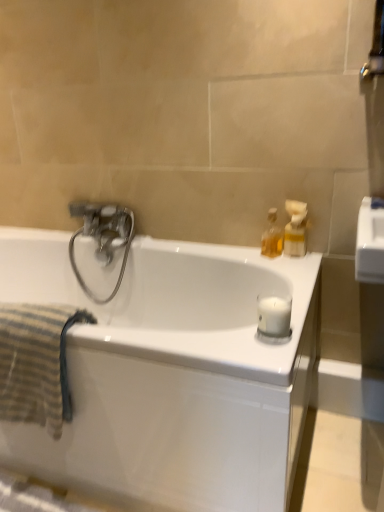
Question: Is white matte candle at right with metallic silver towel bar at upper right?

Choices:
 (A) yes
 (B) no

Answer: (B)

Question: Is white matte candle at right turned away from metallic silver towel bar at upper right?

Choices:
 (A) no
 (B) yes

Answer: (A)

Question: Considering the relative sizes of white matte candle at right and metallic silver towel bar at upper right in the image provided, is white matte candle at right smaller than metallic silver towel bar at upper right?

Choices:
 (A) no
 (B) yes

Answer: (B)

Question: Is white matte candle at right behind metallic silver towel bar at upper right?

Choices:
 (A) yes
 (B) no

Answer: (B)

Question: From the image's perspective, is white matte candle at right located above metallic silver towel bar at upper right?

Choices:
 (A) yes
 (B) no

Answer: (B)

Question: Considering the relative sizes of white matte candle at right and metallic silver towel bar at upper right in the image provided, is white matte candle at right bigger than metallic silver towel bar at upper right?

Choices:
 (A) no
 (B) yes

Answer: (A)

Question: Is the depth of polished chrome faucet at upper left less than that of white matte candle at right?

Choices:
 (A) yes
 (B) no

Answer: (B)

Question: From a real-world perspective, is polished chrome faucet at upper left over white matte candle at right?

Choices:
 (A) yes
 (B) no

Answer: (B)

Question: Is polished chrome faucet at upper left far away from white matte candle at right?

Choices:
 (A) yes
 (B) no

Answer: (B)

Question: Is polished chrome faucet at upper left turned away from white matte candle at right?

Choices:
 (A) yes
 (B) no

Answer: (B)

Question: Is polished chrome faucet at upper left smaller than white matte candle at right?

Choices:
 (A) yes
 (B) no

Answer: (B)

Question: From the image's perspective, is polished chrome faucet at upper left on white matte candle at right?

Choices:
 (A) no
 (B) yes

Answer: (B)

Question: Is white glossy bathtub at center to the right of white matte candle at right from the viewer's perspective?

Choices:
 (A) no
 (B) yes

Answer: (A)